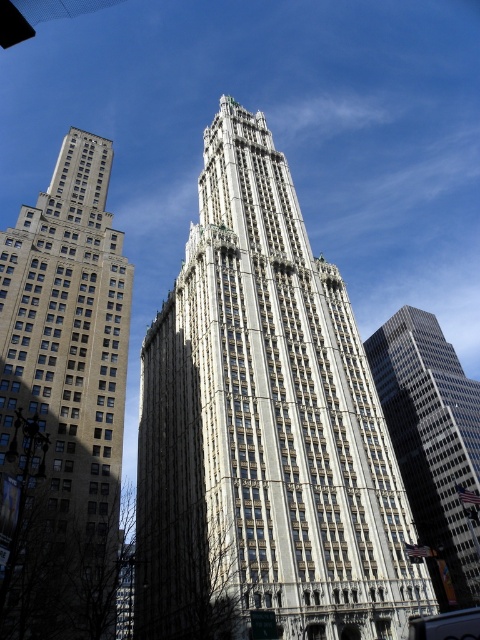
Question: Does white stone skyscraper at center appear under beige stone building at left?

Choices:
 (A) yes
 (B) no

Answer: (A)

Question: Considering the relative positions of white stone skyscraper at center and beige stone building at left in the image provided, where is white stone skyscraper at center located with respect to beige stone building at left?

Choices:
 (A) below
 (B) above

Answer: (A)

Question: Which is nearer to the beige stone building at left?

Choices:
 (A) white stone skyscraper at center
 (B) glassy reflective skyscraper at right

Answer: (A)

Question: In this image, where is beige stone building at left located relative to glassy reflective skyscraper at right?

Choices:
 (A) right
 (B) left

Answer: (B)

Question: Which of the following is the farthest from the observer?

Choices:
 (A) beige stone building at left
 (B) glassy reflective skyscraper at right

Answer: (B)

Question: Which of the following is the farthest from the observer?

Choices:
 (A) (475, 468)
 (B) (72, 595)
 (C) (166, 440)

Answer: (A)